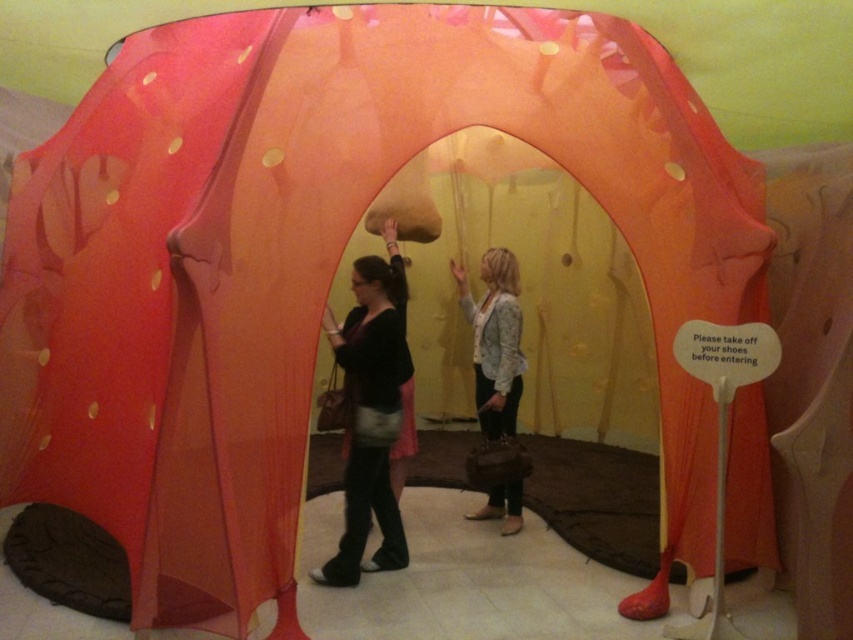
Question: Which of the following is the farthest from the observer?

Choices:
 (A) light blue textured jacket at center
 (B) matte black sweater at center

Answer: (A)

Question: Is matte black sweater at center to the left of light blue textured jacket at center from the viewer's perspective?

Choices:
 (A) no
 (B) yes

Answer: (B)

Question: Which object appears closest to the camera in this image?

Choices:
 (A) light blue textured jacket at center
 (B) matte black sweater at center

Answer: (B)

Question: Can you confirm if matte black sweater at center is smaller than light blue textured jacket at center?

Choices:
 (A) no
 (B) yes

Answer: (A)

Question: Which point is farther from the camera taking this photo?

Choices:
 (A) (495, 385)
 (B) (386, 371)

Answer: (A)

Question: Can you confirm if matte black sweater at center is thinner than light blue textured jacket at center?

Choices:
 (A) yes
 (B) no

Answer: (B)